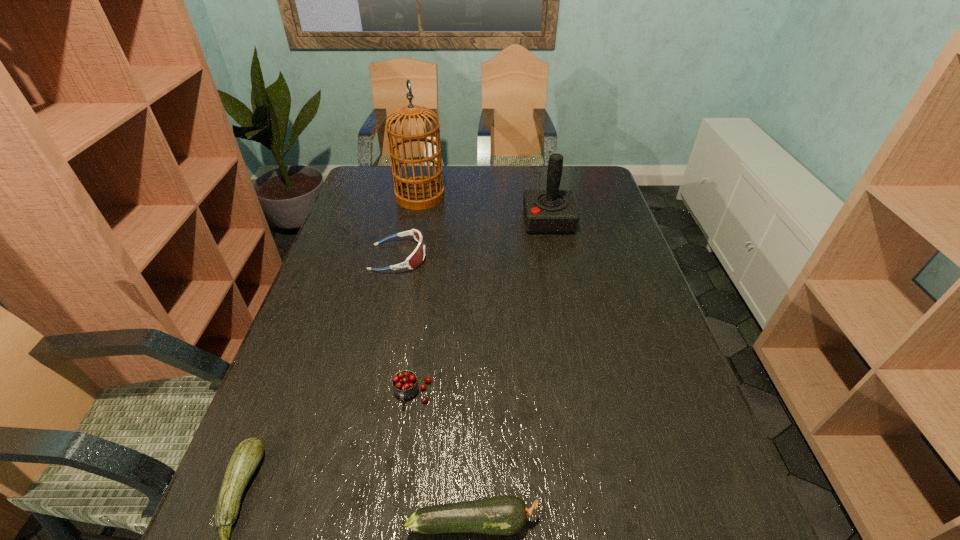
You are a GUI agent. You are given a task and a screenshot of the screen. Output one action in this format:
    pyautogui.click(x=<x>, y=<y>)
    Task: Click on the free location located on the handle side of the fourth shortest object
    
    Given the screenshot: What is the action you would take?
    pyautogui.click(x=394, y=535)

Where is `vacant space located 0.280m on the front-facing side of the goggles`? vacant space located 0.280m on the front-facing side of the goggles is located at coordinates (519, 257).

In order to click on object that is at the far edge in this screenshot , I will do `click(421, 192)`.

Where is `object that is at the left edge`? object that is at the left edge is located at coordinates (416, 258).

At what (x,y) coordinates should I click in order to perform the action: click on object positioned at the right edge. Please return your answer as a coordinate pair (x, y). Looking at the image, I should click on (552, 211).

Where is `free region at the far edge`? The height and width of the screenshot is (540, 960). free region at the far edge is located at coordinates (522, 186).

The image size is (960, 540). In order to click on vacant space at the left edge of the desktop in this screenshot , I will do `click(324, 288)`.

The width and height of the screenshot is (960, 540). Identify the location of vacant space at the right edge of the desktop. (598, 249).

Where is `free space between the second tallest object and the cherry`? free space between the second tallest object and the cherry is located at coordinates (481, 307).

Locate an element on the screen. vacant area that lies between the birdcage and the fifth shortest object is located at coordinates (485, 209).